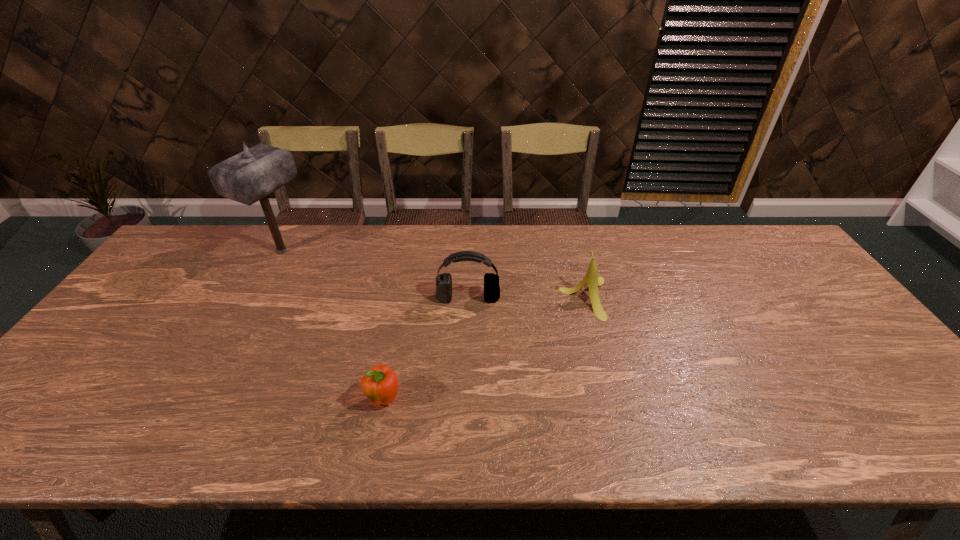
The height and width of the screenshot is (540, 960). I want to click on free region located on the back of the pepper, so click(394, 354).

You are a GUI agent. You are given a task and a screenshot of the screen. Output one action in this format:
    pyautogui.click(x=<x>, y=<y>)
    Task: Click on the object present at the far edge
    
    Given the screenshot: What is the action you would take?
    click(x=248, y=177)

I want to click on vacant space at the far edge, so click(x=372, y=225).

The image size is (960, 540). Find the location of `vacant region at the near edge of the desktop`. vacant region at the near edge of the desktop is located at coordinates (752, 442).

At what (x,y) coordinates should I click in order to perform the action: click on vacant space at the left edge. Please return your answer as a coordinate pair (x, y). Looking at the image, I should click on (158, 294).

What are the coordinates of `free region at the right edge of the desktop` in the screenshot? It's located at pos(754,272).

This screenshot has height=540, width=960. In the image, there is a desktop. Identify the location of vacant space at the near left corner. (89, 434).

This screenshot has width=960, height=540. In the image, there is a desktop. What are the coordinates of `free space at the far right corner` in the screenshot? It's located at (763, 261).

You are a GUI agent. You are given a task and a screenshot of the screen. Output one action in this format:
    pyautogui.click(x=<x>, y=<y>)
    Task: Click on the vacant area that lies between the second tallest object and the banana
    Image resolution: width=960 pixels, height=540 pixels.
    Given the screenshot: What is the action you would take?
    pyautogui.click(x=526, y=298)

Identify the location of vacant area between the banana and the farthest object. The image size is (960, 540). (433, 275).